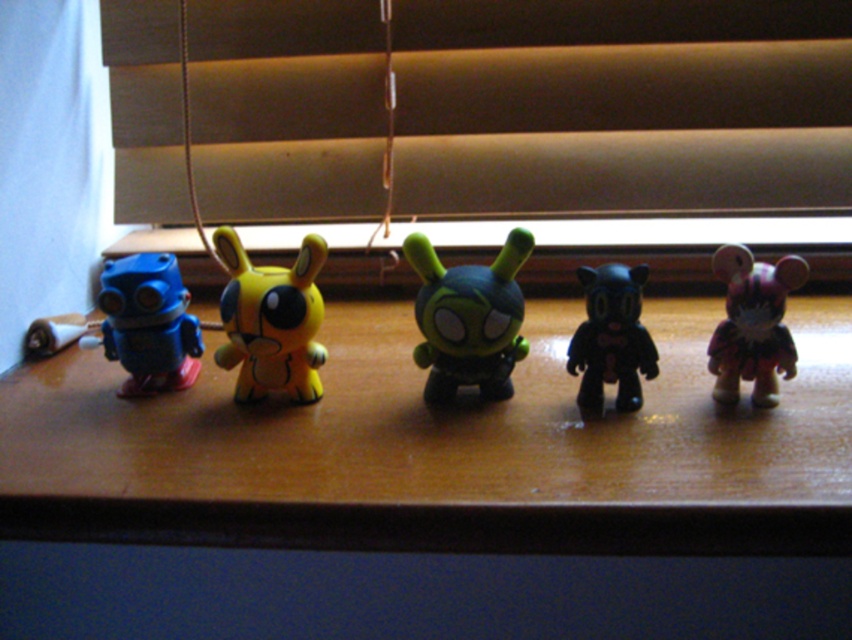
Can you confirm if green matte toy at center is taller than matte blue robot at left?

Correct, green matte toy at center is much taller as matte blue robot at left.

Does green matte toy at center appear on the left side of matte blue robot at left?

In fact, green matte toy at center is to the right of matte blue robot at left.

Is point (444, 396) more distant than point (170, 330)?

No, (444, 396) is closer to viewer.

Identify the location of green matte toy at center. The width and height of the screenshot is (852, 640). (468, 317).

Which is behind, point (490, 337) or point (766, 332)?

The point (766, 332) is behind.

Is green matte toy at center wider than shiny purple bear at right?

Yes, green matte toy at center is wider than shiny purple bear at right.

Does point (481, 284) come farther from viewer compared to point (741, 253)?

No, it is not.

Find the location of a particular element. The height and width of the screenshot is (640, 852). green matte toy at center is located at coordinates (468, 317).

Is yellow matte pikachu at center to the left of matte blue robot at left from the viewer's perspective?

No, yellow matte pikachu at center is not to the left of matte blue robot at left.

Is point (262, 291) positioned behind point (127, 346)?

No, (262, 291) is closer to viewer.

At what (x,y) coordinates should I click in order to perform the action: click on yellow matte pikachu at center. Please return your answer as a coordinate pair (x, y). Looking at the image, I should click on (271, 321).